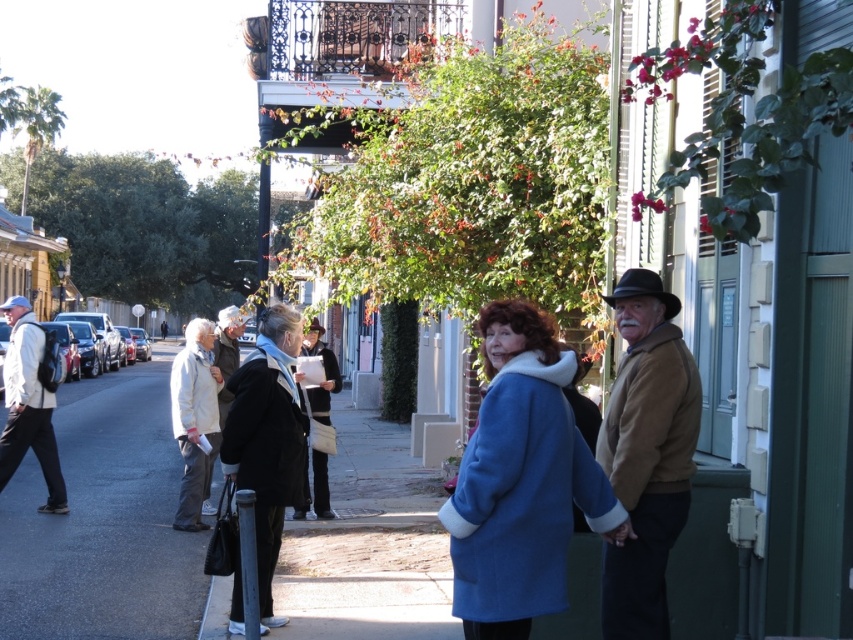
You are a delivery person who needs to place a small package on the dark asphalt pavement at lower left and the black leather coat at center. Which surface can the package be placed on without it rolling away?

The black leather coat at center is taller than the dark asphalt pavement at lower left, so the package can be placed on the black leather coat at center without rolling away.

You are a tailor who needs to determine which coat requires more fabric for alterations. Based on the image, which coat would need more fabric, the black wool coat at center or the light beige fabric coat at left?

The light beige fabric coat at left requires more fabric for alterations because it is thicker than the black wool coat at center.